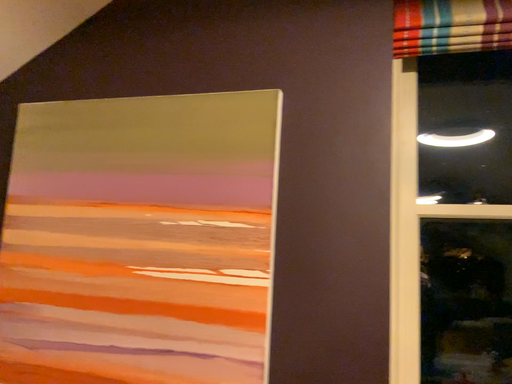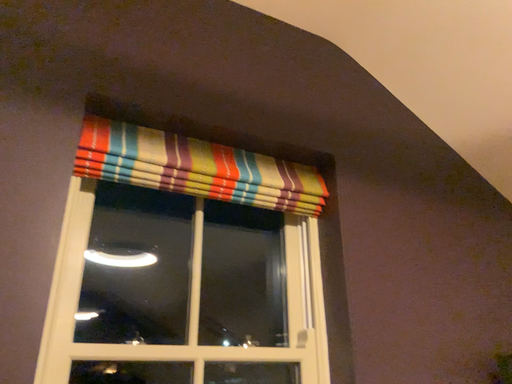
Question: Which way did the camera rotate in the video?

Choices:
 (A) rotated upward
 (B) rotated downward

Answer: (A)